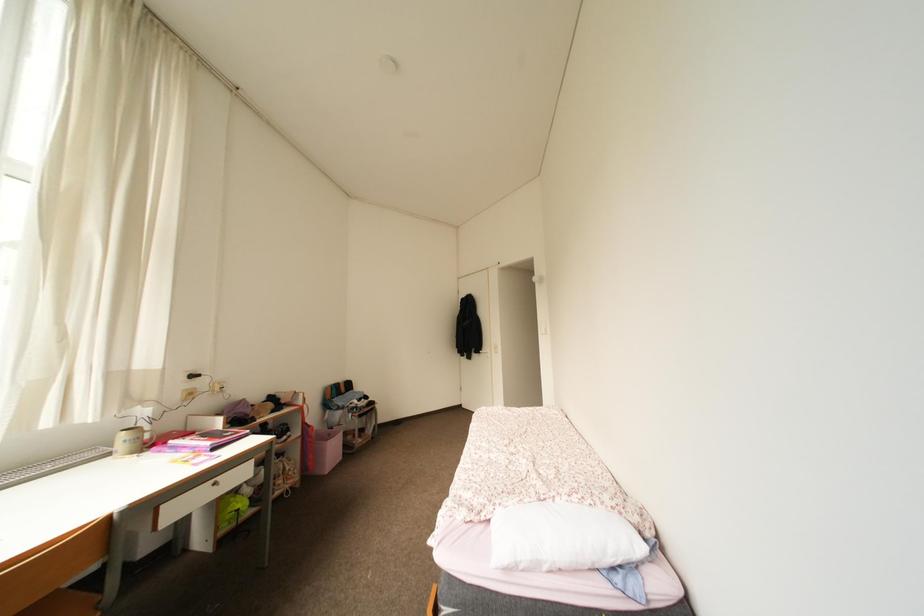
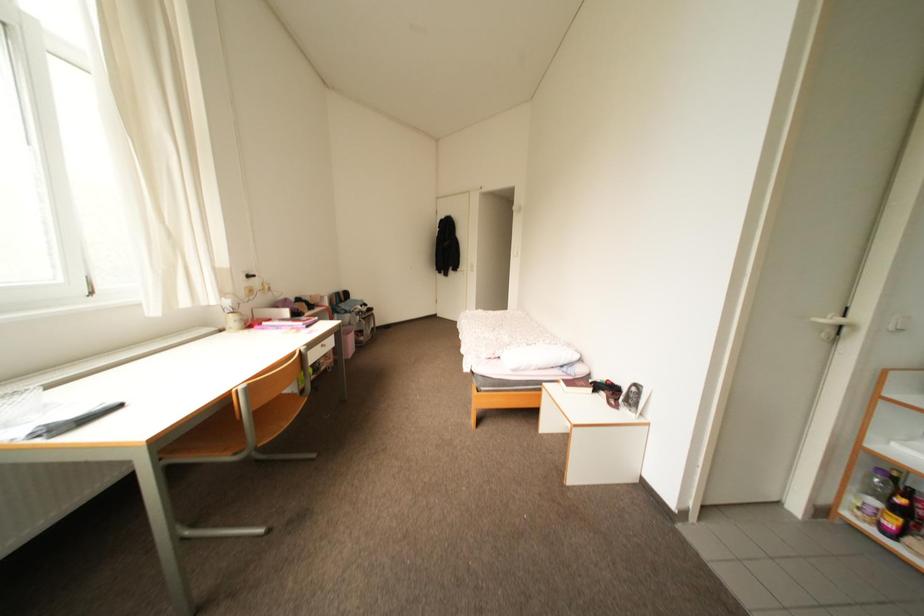
In a continuous first-person perspective shot, in which direction is the camera moving?

The cameraman walked toward left, backward.